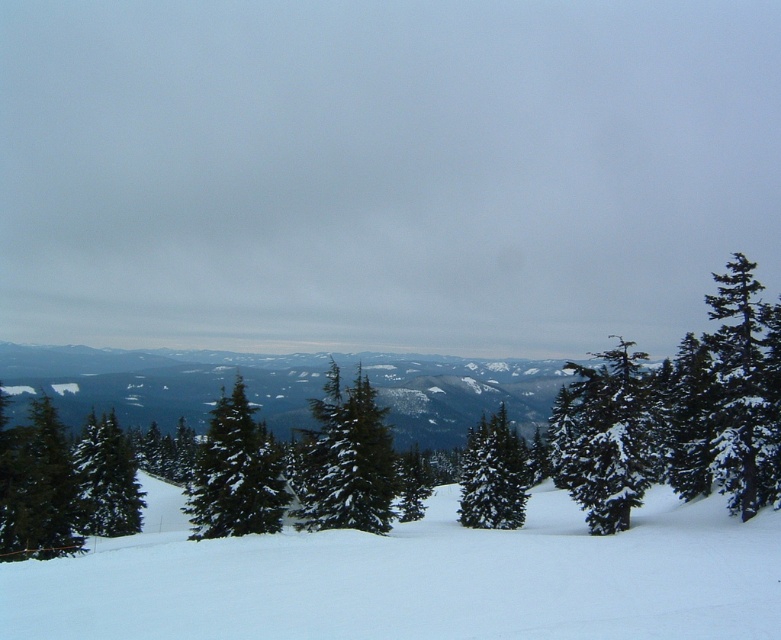
You are standing in the winter landscape and want to walk towards the green matte tree at right. Which direction should you move relative to the white snow at lower left?

Since the white snow at lower left is in front of the green matte tree at right, you should move towards the white snow at lower left to reach the tree.

You are standing at the origin point of the winter landscape. There is a point marked at coordinates point [601,436]. Based on the description, what object does this point correspond to?

The point [601,436] corresponds to the snow covered evergreen at right.